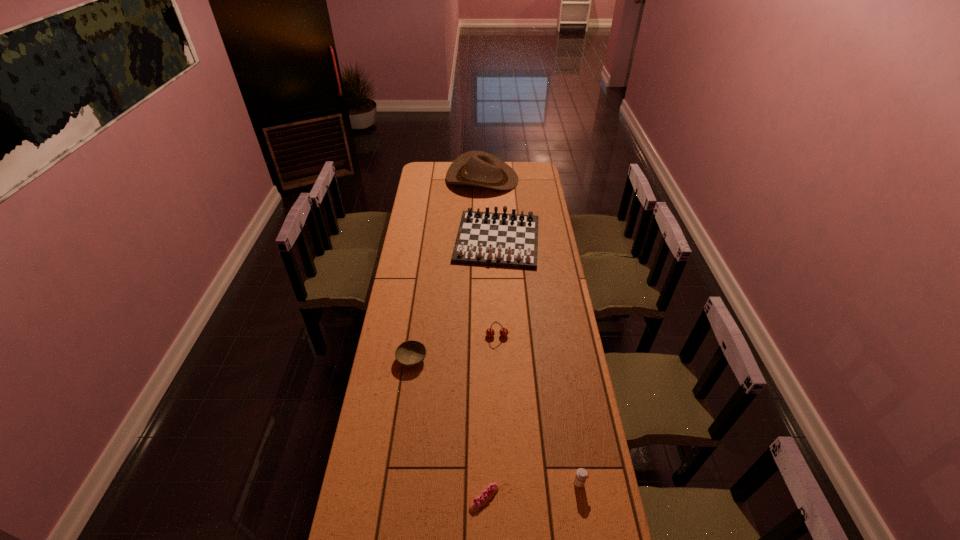
Where is `medicine that is at the right edge`? The width and height of the screenshot is (960, 540). medicine that is at the right edge is located at coordinates (581, 475).

Identify the location of object that is at the far right corner. (475, 168).

Where is `free point at the left edge`? free point at the left edge is located at coordinates pyautogui.click(x=415, y=231).

You are a GUI agent. You are given a task and a screenshot of the screen. Output one action in this format:
    pyautogui.click(x=<x>, y=<y>)
    Task: Click on the free space at the right edge
    
    Given the screenshot: What is the action you would take?
    pyautogui.click(x=589, y=404)

The image size is (960, 540). I want to click on vacant area at the far right corner of the desktop, so click(x=535, y=172).

This screenshot has width=960, height=540. What are the coordinates of `free space that is in between the eclair and the cowboy hat` in the screenshot? It's located at (483, 339).

Find the location of `vacant area between the cherry and the shortest object`. vacant area between the cherry and the shortest object is located at coordinates (491, 417).

Where is `vacant point located between the medicine and the farthest object`? This screenshot has width=960, height=540. vacant point located between the medicine and the farthest object is located at coordinates (531, 331).

Where is `blank region between the second shortest object and the shortest object`? blank region between the second shortest object and the shortest object is located at coordinates (448, 429).

Locate an element on the screen. Image resolution: width=960 pixels, height=540 pixels. vacant region between the bowl and the second farthest object is located at coordinates (455, 300).